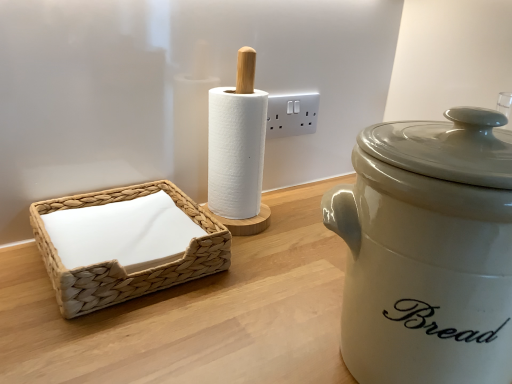
Question: From a real-world perspective, is woven beige basket at left positioned under white plastic electric outlet at upper center based on gravity?

Choices:
 (A) yes
 (B) no

Answer: (A)

Question: Does woven beige basket at left have a lesser height compared to white plastic electric outlet at upper center?

Choices:
 (A) yes
 (B) no

Answer: (A)

Question: Considering the relative positions of woven beige basket at left and white plastic electric outlet at upper center in the image provided, is woven beige basket at left behind white plastic electric outlet at upper center?

Choices:
 (A) yes
 (B) no

Answer: (B)

Question: Is woven beige basket at left at the right side of white plastic electric outlet at upper center?

Choices:
 (A) no
 (B) yes

Answer: (A)

Question: Is woven beige basket at left touching white plastic electric outlet at upper center?

Choices:
 (A) yes
 (B) no

Answer: (B)

Question: From the image's perspective, is white plastic electric outlet at upper center located above or below woven beige basket at left?

Choices:
 (A) above
 (B) below

Answer: (A)

Question: Relative to woven beige basket at left, is white plastic electric outlet at upper center in front or behind?

Choices:
 (A) behind
 (B) front

Answer: (A)

Question: Considering the positions of white plastic electric outlet at upper center and woven beige basket at left in the image, is white plastic electric outlet at upper center bigger or smaller than woven beige basket at left?

Choices:
 (A) big
 (B) small

Answer: (B)

Question: In terms of width, does white plastic electric outlet at upper center look wider or thinner when compared to woven beige basket at left?

Choices:
 (A) wide
 (B) thin

Answer: (B)

Question: Considering the positions of point (488, 155) and point (101, 292), is point (488, 155) closer or farther from the camera than point (101, 292)?

Choices:
 (A) farther
 (B) closer

Answer: (B)

Question: From the image's perspective, is matte white ceramic bread bin at right located above or below woven beige basket at left?

Choices:
 (A) above
 (B) below

Answer: (B)

Question: Is matte white ceramic bread bin at right taller or shorter than woven beige basket at left?

Choices:
 (A) short
 (B) tall

Answer: (B)

Question: Is matte white ceramic bread bin at right situated inside woven beige basket at left or outside?

Choices:
 (A) inside
 (B) outside

Answer: (B)

Question: Choose the correct answer: Is woven beige basket at left inside white plastic electric outlet at upper center or outside it?

Choices:
 (A) inside
 (B) outside

Answer: (B)

Question: In the image, is woven beige basket at left on the left side or the right side of white plastic electric outlet at upper center?

Choices:
 (A) right
 (B) left

Answer: (B)